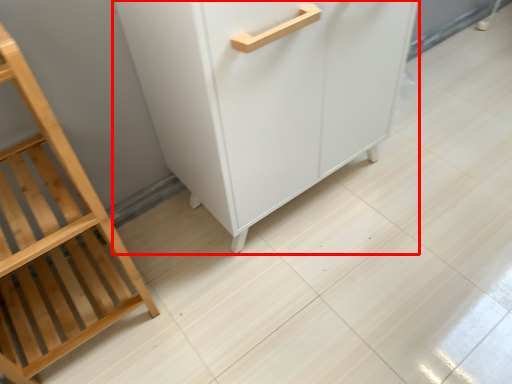
Question: From the image, what is the correct spatial relationship of cupboard (annotated by the red box) in relation to furniture?

Choices:
 (A) right
 (B) left

Answer: (A)